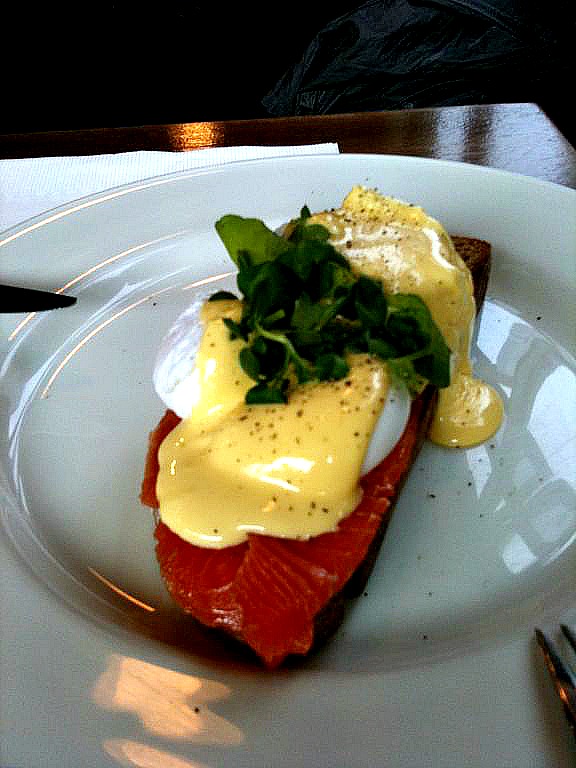
Where is `fork`? This screenshot has width=576, height=768. fork is located at coordinates (555, 666).